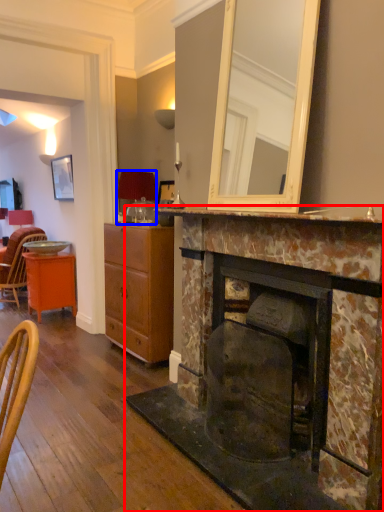
Question: Among these objects, which one is nearest to the camera, fireplace (highlighted by a red box) or lamp (highlighted by a blue box)?

Choices:
 (A) fireplace
 (B) lamp

Answer: (A)